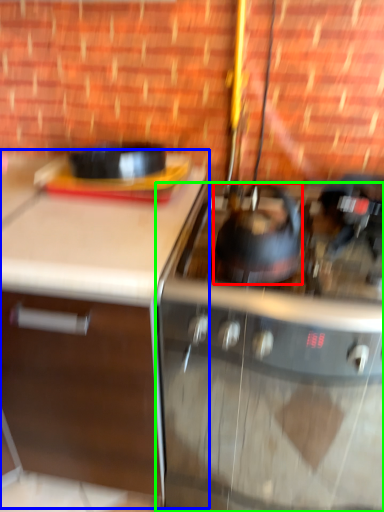
Question: Which is farther away from kitchen appliance (highlighted by a red box)? cabinetry (highlighted by a blue box) or gas stove (highlighted by a green box)?

Choices:
 (A) cabinetry
 (B) gas stove

Answer: (A)